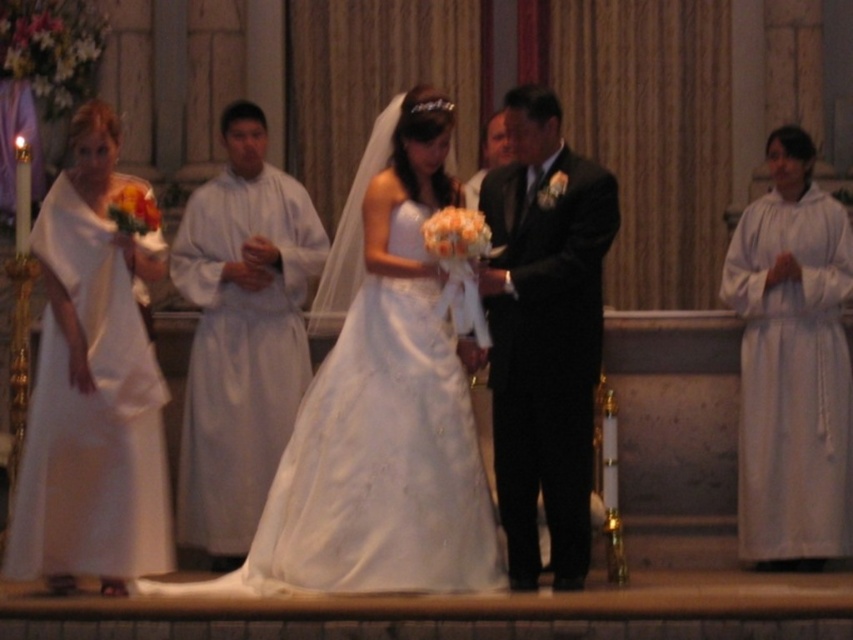
Locate an element on the screen. This screenshot has width=853, height=640. shiny black suit at center is located at coordinates (544, 332).

Does shiny black suit at center have a greater width compared to white cloth at left?

No, shiny black suit at center is not wider than white cloth at left.

Locate an element on the screen. This screenshot has width=853, height=640. shiny black suit at center is located at coordinates (544, 332).

Can you confirm if matte white dress at left is taller than shiny black suit at center?

Yes.

Which is in front, point (166, 488) or point (549, 292)?

Point (166, 488) is more forward.

This screenshot has height=640, width=853. Find the location of `matte white dress at left`. matte white dress at left is located at coordinates (91, 387).

Find the location of `matte white dress at left`. matte white dress at left is located at coordinates (91, 387).

Does satin/sheen wedding dress at center have a greater height compared to white cloth at left?

No, satin/sheen wedding dress at center is not taller than white cloth at left.

Does satin/sheen wedding dress at center lie in front of white cloth at left?

Yes, it is.

Which is behind, point (444, 449) or point (252, 296)?

Positioned behind is point (252, 296).

This screenshot has height=640, width=853. I want to click on satin/sheen wedding dress at center, so click(x=376, y=465).